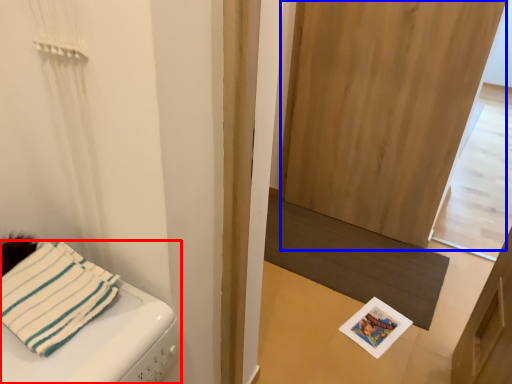
Question: Among these objects, which one is nearest to the camera, furniture (highlighted by a red box) or screen door (highlighted by a blue box)?

Choices:
 (A) furniture
 (B) screen door

Answer: (A)